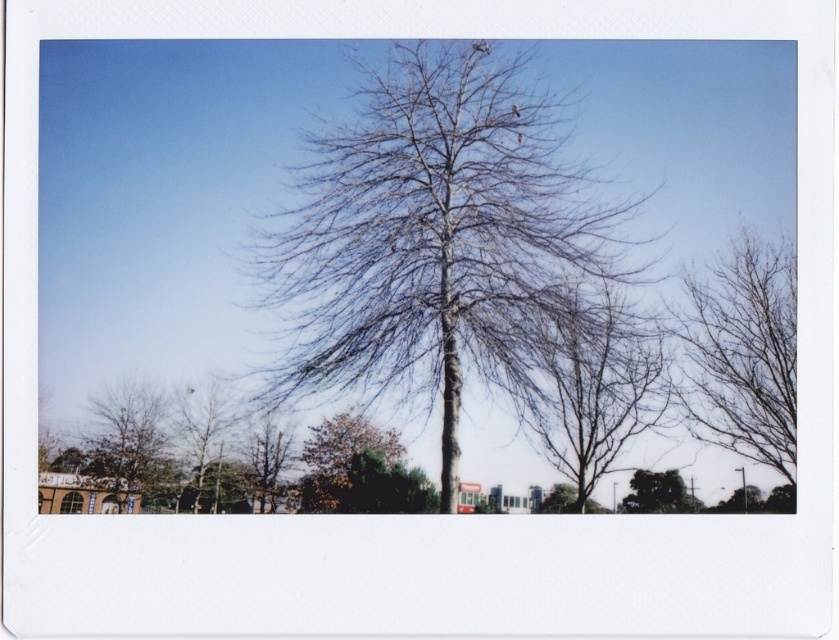
You are standing in a park and see the bare branches at center and the brown matte tree at lower left. Which tree is taller?

The brown matte tree at lower left is taller than the bare branches at center.

You are standing in a park and see two trees on your left side. One is labeled as the brown matte tree at lower left and the other as the brown rough bark tree at lower left. Which tree would you need to walk towards to get a closer look at the one that is nearer to you?

The brown matte tree at lower left is closer to the viewer than the brown rough bark tree at lower left, so you should walk towards the brown matte tree at lower left to get a closer look at the nearer one.

Based on the photo, you are a landscape architect designing a garden and need to place a new bench between the brown matte tree at lower left and the brown rough bark tree at lower left. The bench requires 15 feet of space to be placed comfortably. Based on the scene, do you think there is enough space between them?

The brown matte tree at lower left is 12.96 feet from brown rough bark tree at lower left. Since the required space is 15 feet, there is not enough space to place the bench comfortably between them.